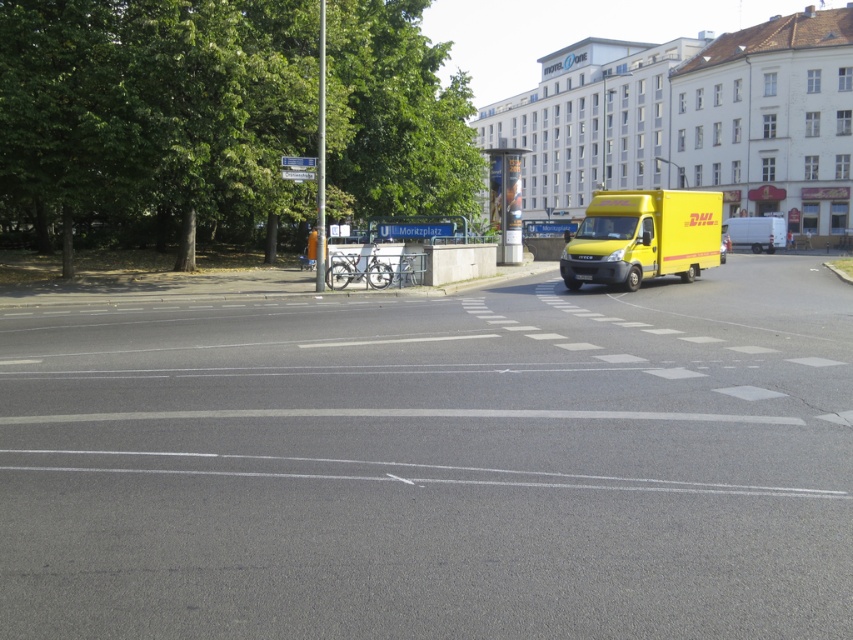
You are a drone operator trying to capture aerial footage of the urban street scene described. Your drone has a maximum flight range of 25 meters. Can the drone safely fly to the green leafy tree at upper left and return without exceeding its range limit?

The green leafy tree at upper left is 23.50 meters away from camera. Since the drone can fly up to 25 meters, it has enough range to reach the tree and return safely without exceeding its limit.

You are a delivery driver who needs to park your vehicle on the street. You see a yellow matte van at center and a yellow rubber van at right. Which van takes up more space on the road?

The yellow matte van at center is larger in size than the yellow rubber van at right, so it takes up more space on the road.

You are a delivery driver who needs to park your vehicle in a spot that is not in the no parking zone. You see a yellow matte van at center and a yellow rubber van at right. Which van is closer to the allowed parking area?

The yellow rubber van at right is closer to the allowed parking area because the yellow matte van at center is positioned to its left side, meaning the yellow rubber van at right is further away from the no parking zone marked by the dashed lines.